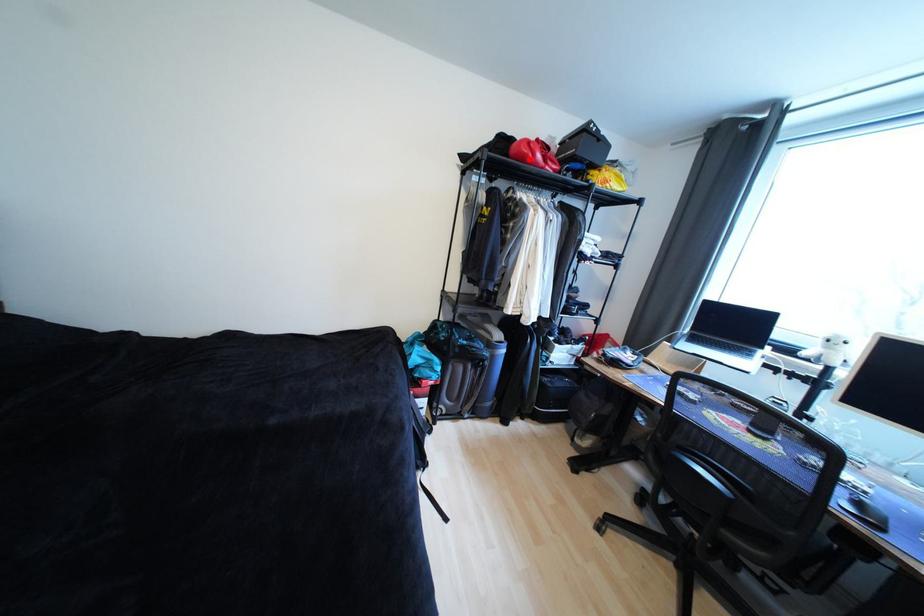
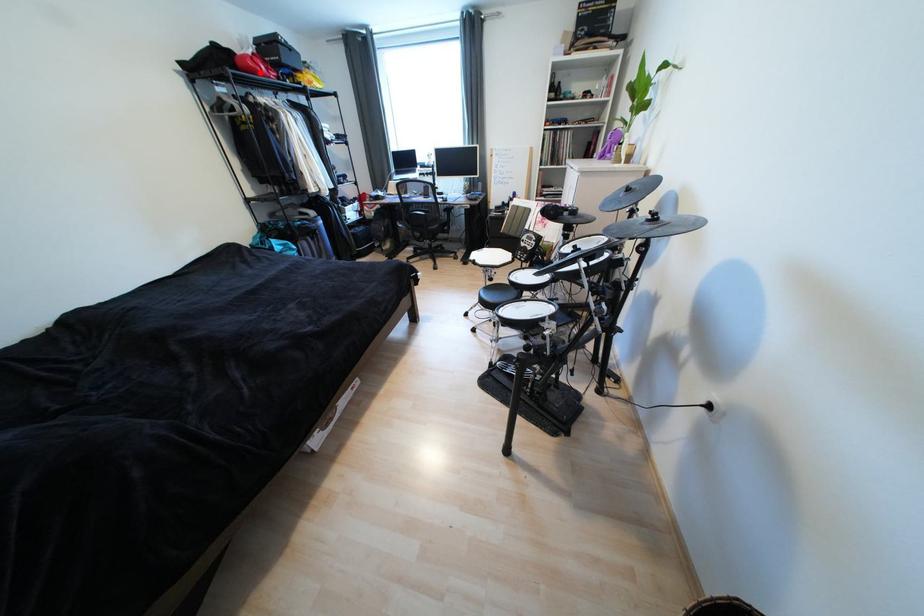
I am providing you with two images of the same scene from different viewpoints. A red point is marked on the first image and another point is marked on the second image. Is the red point in image1 aligned with the point shown in image2?

Yes